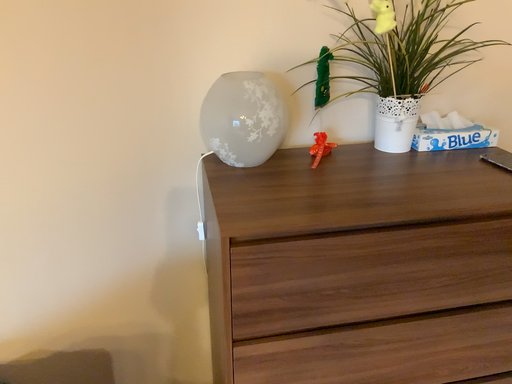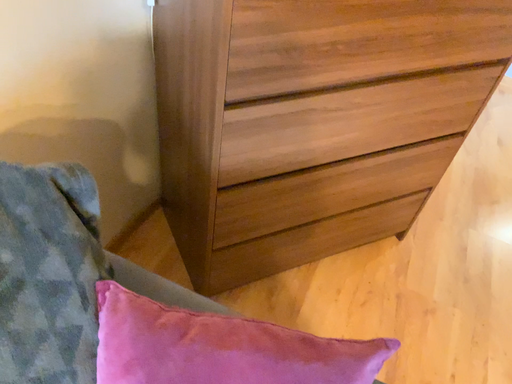
Question: Which way did the camera rotate in the video?

Choices:
 (A) rotated right
 (B) rotated left

Answer: (A)